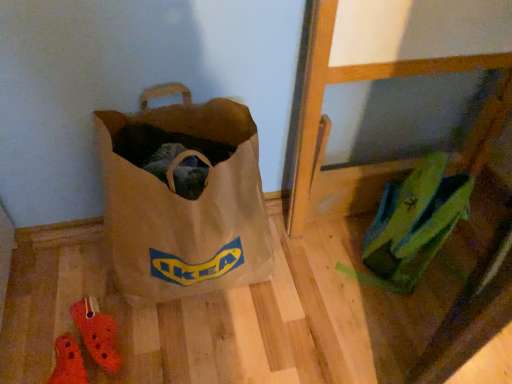
Find the location of a particular element. The height and width of the screenshot is (384, 512). free space to the left of brown canvas bag at lower left is located at coordinates (56, 287).